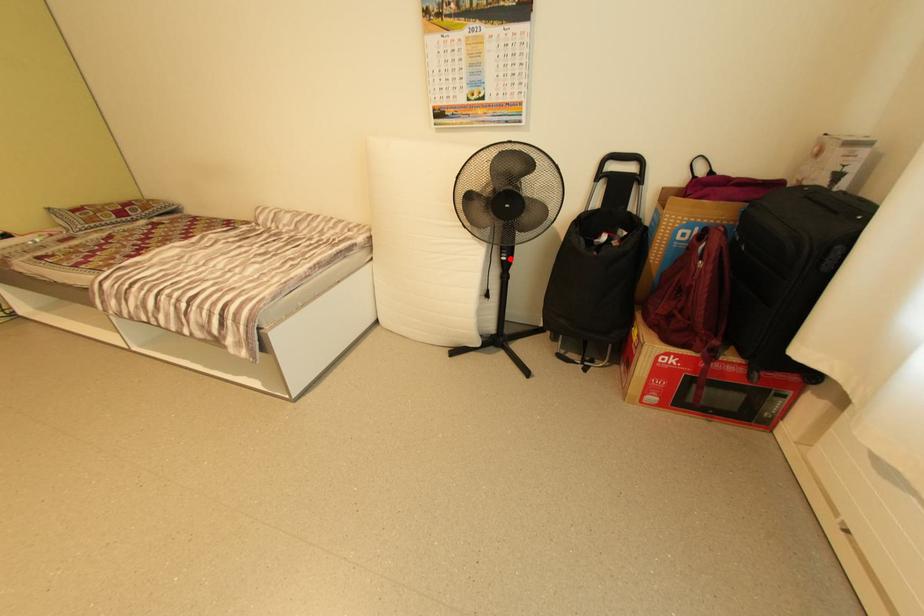
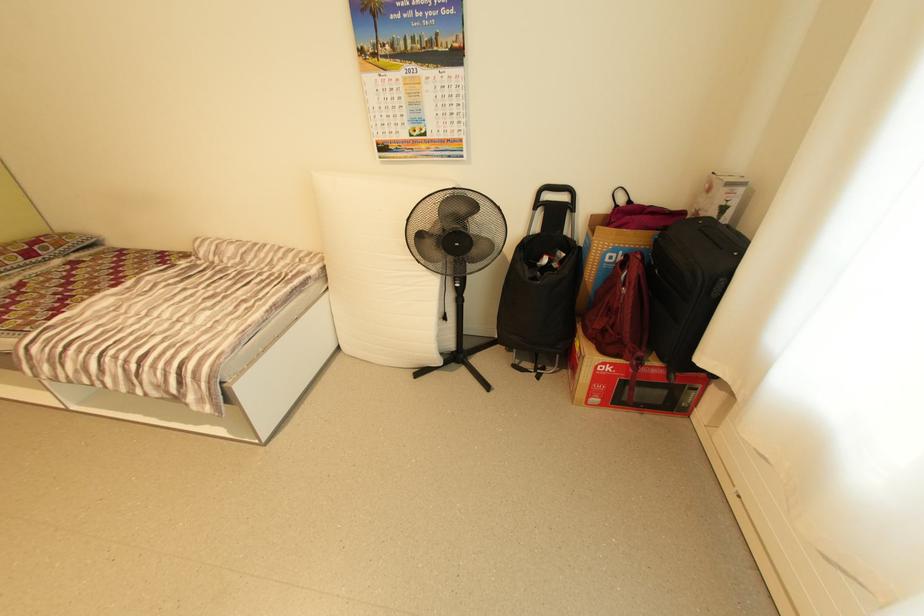
In the second image, find the point that corresponds to the highlighted location in the first image.

(464, 286)